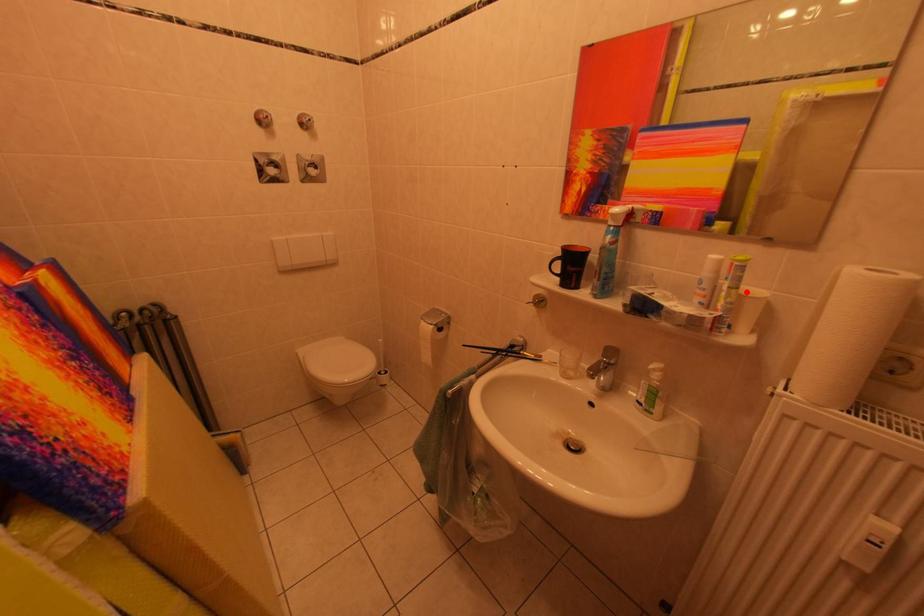
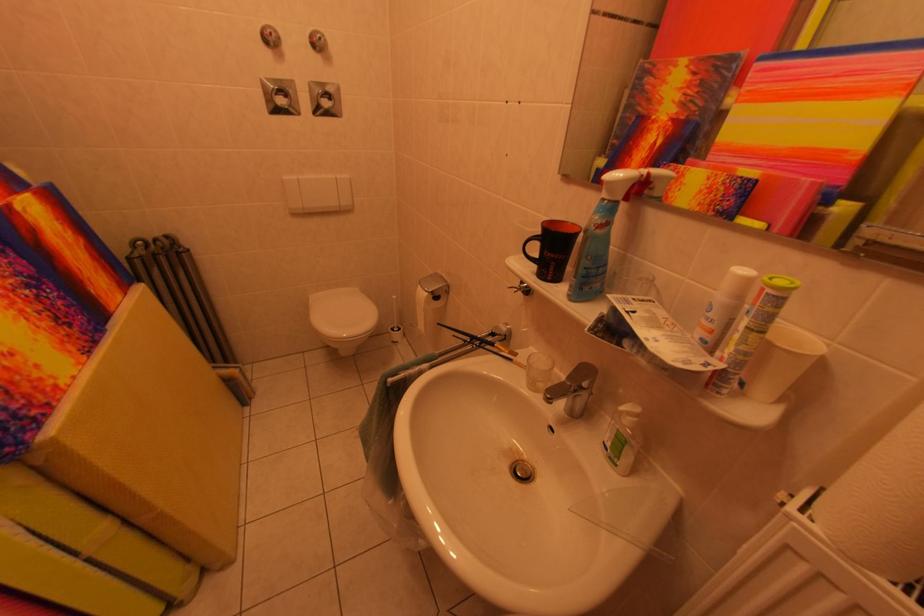
Question: I am providing you with two images of the same scene from different viewpoints. A red point is marked on the first image. Can you still see the location of the red point in image 2?

Choices:
 (A) Yes
 (B) No

Answer: (A)